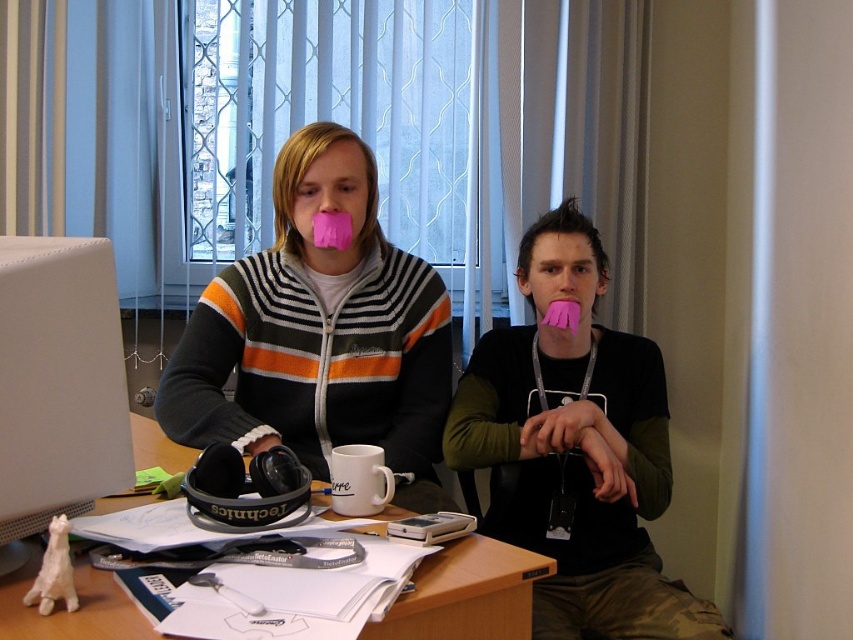
The width and height of the screenshot is (853, 640). Describe the element at coordinates (320, 333) in the screenshot. I see `matte black hoodie at center` at that location.

Does point (218, 307) lie behind point (558, 429)?

That is True.

Is point (305, 328) closer to camera compared to point (570, 355)?

Yes, point (305, 328) is in front of point (570, 355).

You are a GUI agent. You are given a task and a screenshot of the screen. Output one action in this format:
    pyautogui.click(x=<x>, y=<y>)
    Task: Click on the matte black hoodie at center
    The height and width of the screenshot is (640, 853).
    Given the screenshot: What is the action you would take?
    pyautogui.click(x=320, y=333)

Is point (416, 490) closer to camera compared to point (401, 512)?

No.

Who is more forward, [430,282] or [491,611]?

Point [491,611] is more forward.

Is point (396, 307) behind point (100, 632)?

Yes, it is.

This screenshot has height=640, width=853. I want to click on matte black hoodie at center, so click(x=320, y=333).

Consider the image. Who is positioned more to the right, matte black shirt at center or wooden desk at center?

matte black shirt at center

Is point (515, 435) less distant than point (32, 625)?

No, it is behind (32, 625).

The width and height of the screenshot is (853, 640). I want to click on matte black shirt at center, so click(576, 448).